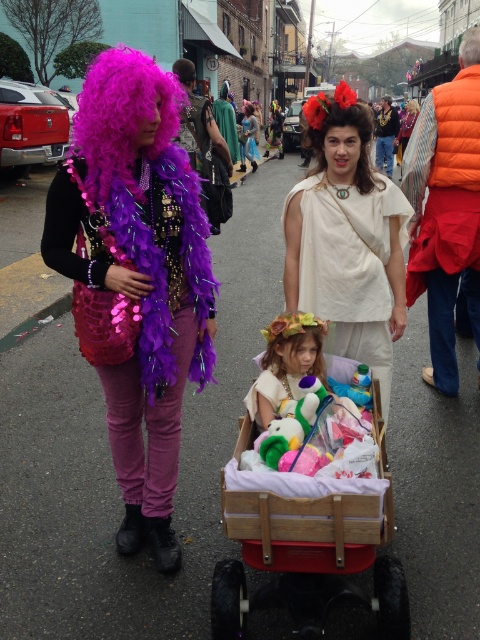
Question: Considering the relative positions of purple feather boa at left and purple feather boa at upper left in the image provided, where is purple feather boa at left located with respect to purple feather boa at upper left?

Choices:
 (A) below
 (B) above

Answer: (A)

Question: In this image, where is matte white toga at center located relative to fluffy purple wig at center?

Choices:
 (A) left
 (B) right

Answer: (B)

Question: Among these objects, which one is farthest from the camera?

Choices:
 (A) fluffy purple wig at center
 (B) gray/short hair at upper left
 (C) wooden cart at center
 (D) matte white toga at center

Answer: (B)

Question: Does velvet gold vest at center appear over shiny metallic mask at center?

Choices:
 (A) yes
 (B) no

Answer: (A)

Question: Which point appears closest to the camera in this image?

Choices:
 (A) (472, 52)
 (B) (431, 106)

Answer: (B)

Question: Among these points, which one is nearest to the camera?

Choices:
 (A) (400, 300)
 (B) (386, 138)
 (C) (123, 547)
 (D) (245, 134)

Answer: (C)